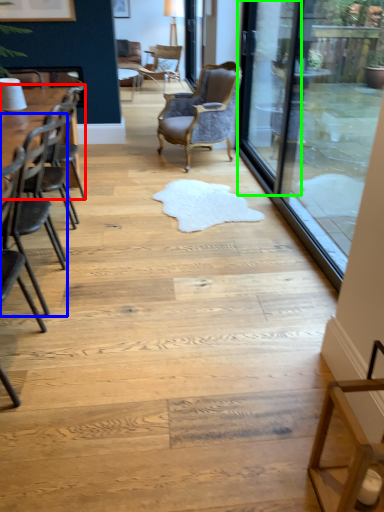
Question: Considering the real-world distances, which object is farthest from table (highlighted by a red box)? chair (highlighted by a blue box) or screen door (highlighted by a green box)?

Choices:
 (A) chair
 (B) screen door

Answer: (B)